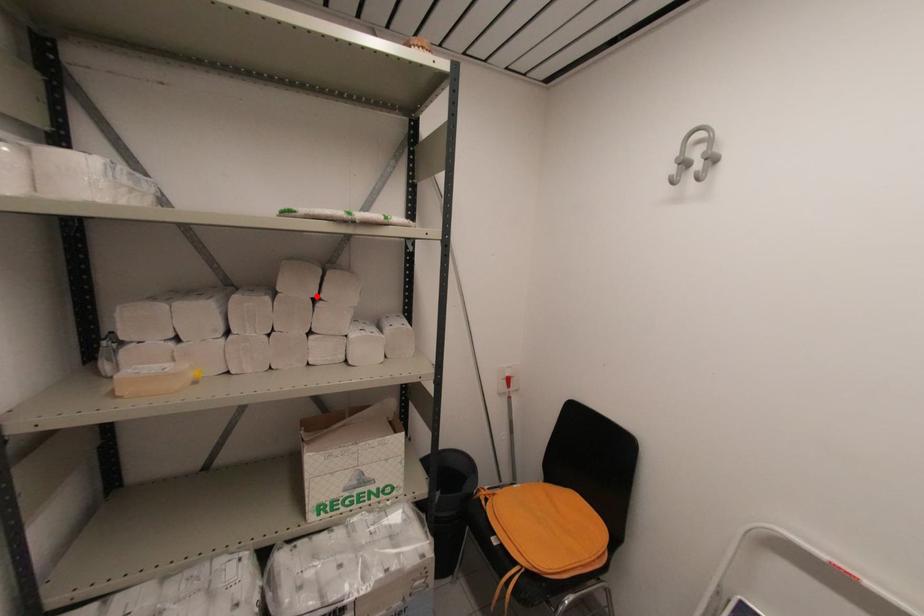
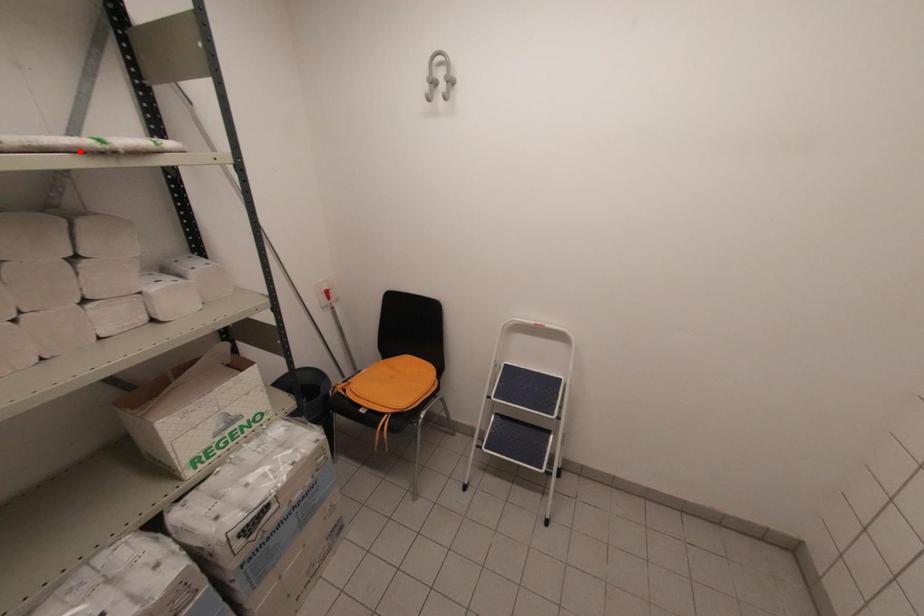
I am providing you with two images of the same scene from different viewpoints. A red point is marked on the first image and another point is marked on the second image. Are the points marked in image1 and image2 representing the same 3D position?

No